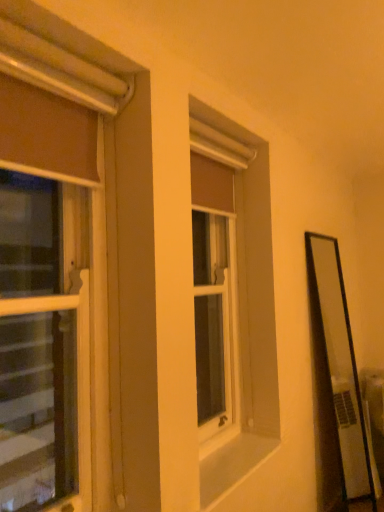
Question: Visually, is matte brown curtain at left, which ranks as the second window in right-to-left order, positioned to the left or to the right of white smooth window sill at center?

Choices:
 (A) left
 (B) right

Answer: (A)

Question: Choose the correct answer: Is matte brown curtain at left, marked as the first window in a front-to-back arrangement, inside white smooth window sill at center or outside it?

Choices:
 (A) outside
 (B) inside

Answer: (A)

Question: Which object is positioned closest to the white smooth window sill at center?

Choices:
 (A) matte brown curtain at left, marked as the first window in a front-to-back arrangement
 (B) matte brown curtain at center, marked as the second window in a front-to-back arrangement

Answer: (B)

Question: Which is farther from the matte brown curtain at center, which ranks as the second window in left-to-right order?

Choices:
 (A) matte brown curtain at left, which is counted as the 2th window, starting from the back
 (B) white smooth window sill at center

Answer: (A)